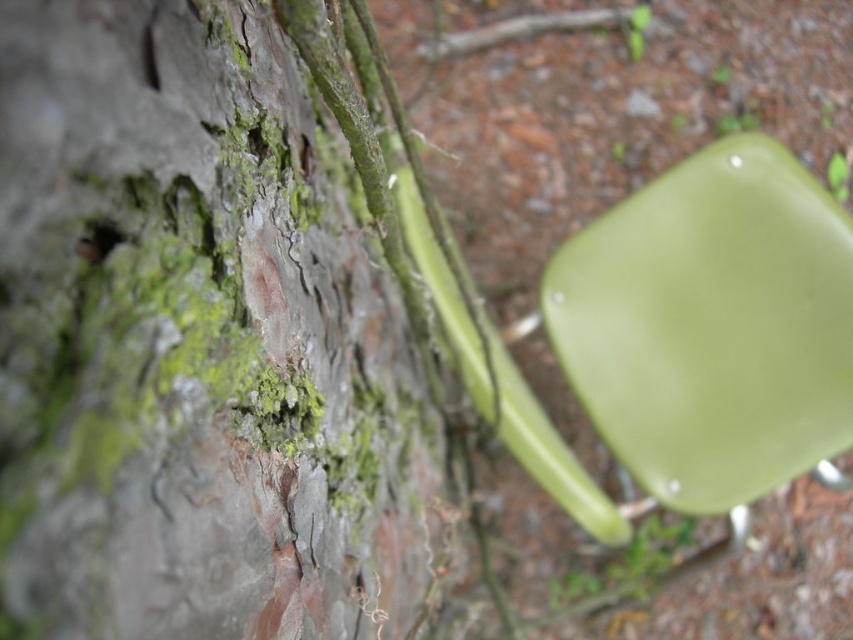
Question: Which object is farther from the camera taking this photo?

Choices:
 (A) matte green plastic chair at upper right
 (B) green matte tree trunk at center

Answer: (A)

Question: Observing the image, what is the correct spatial positioning of green matte tree trunk at center in reference to matte green plastic chair at upper right?

Choices:
 (A) right
 (B) left

Answer: (B)

Question: Is the position of green matte tree trunk at center less distant than that of matte green plastic chair at upper right?

Choices:
 (A) no
 (B) yes

Answer: (B)

Question: Among these points, which one is nearest to the camera?

Choices:
 (A) (323, 272)
 (B) (746, 186)

Answer: (A)

Question: Does green matte tree trunk at center have a greater width compared to matte green plastic chair at upper right?

Choices:
 (A) no
 (B) yes

Answer: (A)

Question: Among these objects, which one is farthest from the camera?

Choices:
 (A) green matte tree trunk at center
 (B) matte green plastic chair at upper right

Answer: (B)